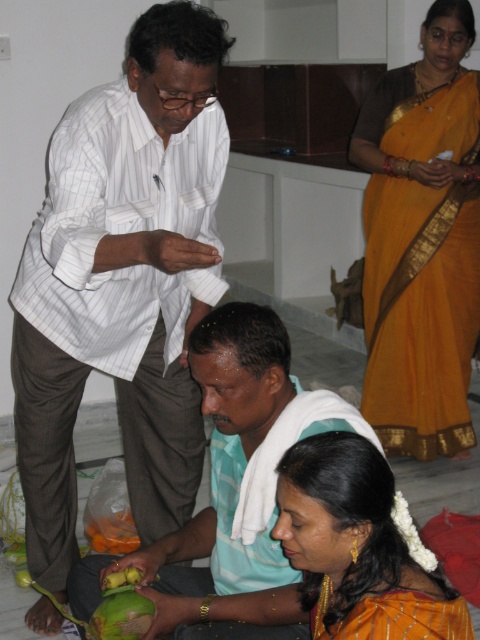
Is orange silk saree at upper right positioned in front of yellow silk saree at lower right?

No, it is not.

Can you confirm if orange silk saree at upper right is positioned above yellow silk saree at lower right?

Correct, orange silk saree at upper right is located above yellow silk saree at lower right.

Is point (474, 333) less distant than point (365, 564)?

No.

Locate an element on the screen. This screenshot has height=640, width=480. orange silk saree at upper right is located at coordinates (421, 241).

In the scene shown: Is yellow silk saree at lower right closer to camera compared to green matte mango at lower left?

Yes.

Between yellow silk saree at lower right and green matte mango at lower left, which one appears on the right side from the viewer's perspective?

yellow silk saree at lower right

Who is more distant from viewer, (367, 509) or (130, 602)?

Positioned behind is point (130, 602).

Find the location of a particular element. This screenshot has width=480, height=640. yellow silk saree at lower right is located at coordinates (357, 547).

Can you confirm if yellow silk saree at lower right is positioned below orange smooth mango at lower left?

Actually, yellow silk saree at lower right is above orange smooth mango at lower left.

Describe the element at coordinates (357, 547) in the screenshot. I see `yellow silk saree at lower right` at that location.

This screenshot has height=640, width=480. What do you see at coordinates (357, 547) in the screenshot?
I see `yellow silk saree at lower right` at bounding box center [357, 547].

At what (x,y) coordinates should I click in order to perform the action: click on yellow silk saree at lower right. Please return your answer as a coordinate pair (x, y). This screenshot has width=480, height=640. Looking at the image, I should click on (357, 547).